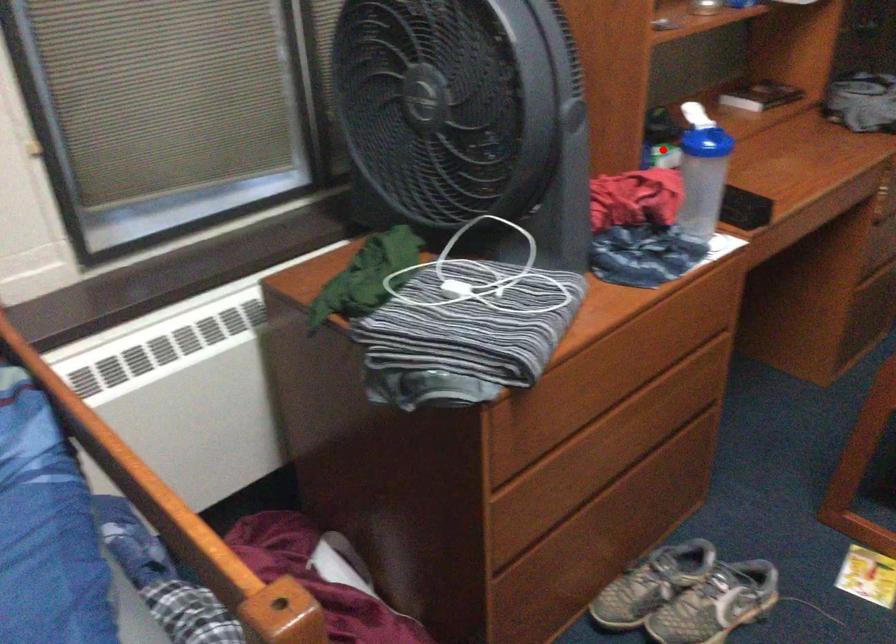
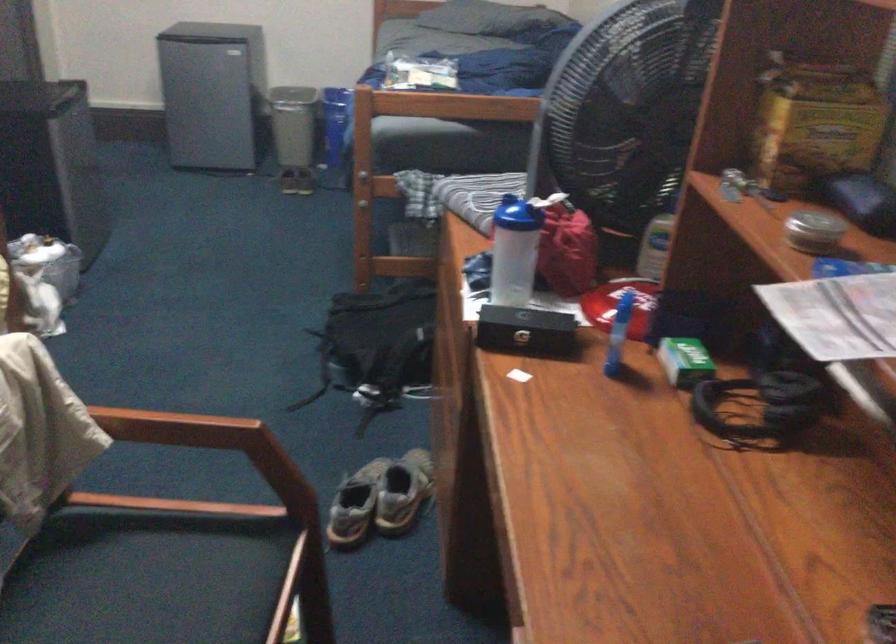
Question: A red point is marked in image1. In image2, is the corresponding 3D point closer to the camera or farther? Reply with the corresponding letter.

Choices:
 (A) The corresponding 3D point is closer.
 (B) The corresponding 3D point is farther.

Answer: (A)